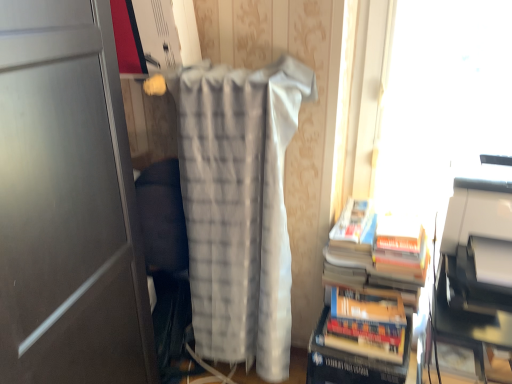
In order to face hardcover book at lower right, should I rotate leftwards or rightwards?

A 14.019 degree turn to the right will do.

What is the approximate height of white plastic printer at right?

white plastic printer at right is 9.37 inches tall.

In order to face hardcover books at right, should I rotate leftwards or rightwards?

To face it directly, rotate right by 15.361 degrees.

Identify the location of white textured blanket at center. click(x=239, y=206).

In order to click on transparent plastic window screen at upper right in this screenshot , I will do `click(443, 94)`.

Considering the sizes of objects white plastic printer at right and transparent plastic window screen at upper right in the image provided, who is bigger, white plastic printer at right or transparent plastic window screen at upper right?

With larger size is transparent plastic window screen at upper right.

Is white plastic printer at right next to transparent plastic window screen at upper right and touching it?

No.

From the image's perspective, relative to transparent plastic window screen at upper right, is white plastic printer at right above or below?

Based on their image positions, white plastic printer at right is located beneath transparent plastic window screen at upper right.

Which is behind, point (492, 267) or point (474, 45)?

The point (474, 45) is more distant.

From the image's perspective, does hardcover books at right appear higher than white textured blanket at center?

No.

Considering the positions of point (358, 326) and point (308, 85), is point (358, 326) closer or farther from the camera than point (308, 85)?

Clearly, point (358, 326) is closer to the camera than point (308, 85).

From a real-world perspective, which is physically below, hardcover books at right or white textured blanket at center?

In real-world perspective, hardcover books at right is lower.

From the image's perspective, which object appears higher, white plastic printer at right or hardcover books at right?

white plastic printer at right is shown above in the image.

Can you confirm if white plastic printer at right is taller than hardcover books at right?

No.

From a real-world perspective, which is physically above, white plastic printer at right or hardcover books at right?

white plastic printer at right, from a real-world perspective.

From the picture: What's the angular difference between white plastic printer at right and hardcover books at right's facing directions?

white plastic printer at right and hardcover books at right are facing 4.56 degrees away from each other.

From the image's perspective, is hardcover books at right over white plastic printer at right?

Actually, hardcover books at right appears below white plastic printer at right in the image.

Looking at this image, from a real-world perspective, is hardcover books at right physically located above or below white plastic printer at right?

From a real-world perspective, hardcover books at right is physically below white plastic printer at right.

Based on their positions, is hardcover books at right located to the left or right of white plastic printer at right?

In the image, hardcover books at right appears on the left side of white plastic printer at right.

Which is closer, (260, 310) or (452, 69)?

Point (260, 310).

Does white textured blanket at center appear on the left side of transparent plastic window screen at upper right?

Yes, white textured blanket at center is to the left of transparent plastic window screen at upper right.

How much distance is there between white textured blanket at center and transparent plastic window screen at upper right?

white textured blanket at center is 24.71 inches from transparent plastic window screen at upper right.

Where is `window screen above the white textured blanket at center (from a real-world perspective)`? The width and height of the screenshot is (512, 384). window screen above the white textured blanket at center (from a real-world perspective) is located at coordinates (443, 94).

Is hardcover books at right closer to camera compared to transparent plastic window screen at upper right?

Yes, it is.

Is transparent plastic window screen at upper right inside hardcover books at right?

That's incorrect, transparent plastic window screen at upper right is not inside hardcover books at right.

Which object is wider, hardcover books at right or transparent plastic window screen at upper right?

hardcover books at right is wider.

How many degrees apart are the facing directions of hardcover books at right and transparent plastic window screen at upper right?

hardcover books at right and transparent plastic window screen at upper right are facing 5.88 degrees away from each other.

Between hardcover book at lower right and white textured blanket at center, which one has smaller size?

hardcover book at lower right is smaller.

Is hardcover book at lower right spatially inside white textured blanket at center, or outside of it?

The correct answer is: outside.

Can you confirm if hardcover book at lower right is thinner than white textured blanket at center?

Yes, hardcover book at lower right is thinner than white textured blanket at center.

Which is closer to the camera, (x=336, y=333) or (x=227, y=188)?

Point (x=336, y=333) is farther from the camera than point (x=227, y=188).

You are a GUI agent. You are given a task and a screenshot of the screen. Output one action in this format:
    pyautogui.click(x=<x>, y=<y>)
    Task: Click on the printer that is above the transparent plastic window screen at upper right (from a real-world perspective)
    This screenshot has height=384, width=512.
    Given the screenshot: What is the action you would take?
    pyautogui.click(x=478, y=237)

Locate an element on the screen. The width and height of the screenshot is (512, 384). book to the right of white textured blanket at center is located at coordinates (361, 322).

When comparing their distances from white plastic printer at right, does transparent plastic window screen at upper right or hardcover books at right seem further?

The object further to white plastic printer at right is transparent plastic window screen at upper right.

When comparing their distances from hardcover books at right, does white plastic printer at right or transparent plastic window screen at upper right seem closer?

Based on the image, white plastic printer at right appears to be nearer to hardcover books at right.

When comparing their distances from white plastic printer at right, does hardcover books at right or white textured blanket at center seem further?

white textured blanket at center lies further to white plastic printer at right than the other object.

Estimate the real-world distances between objects in this image. Which object is closer to hardcover books at right, hardcover book at lower right or white textured blanket at center?

The object closer to hardcover books at right is hardcover book at lower right.

Estimate the real-world distances between objects in this image. Which object is closer to transparent plastic window screen at upper right, hardcover books at right or white plastic printer at right?

The object closer to transparent plastic window screen at upper right is white plastic printer at right.

From the picture: Considering their positions, is white textured blanket at center positioned further to hardcover books at right than hardcover book at lower right?

white textured blanket at center lies further to hardcover books at right than the other object.

Which object lies further to the anchor point white textured blanket at center, transparent plastic window screen at upper right or hardcover books at right?

transparent plastic window screen at upper right is further to white textured blanket at center.

From the image, which object appears to be nearer to transparent plastic window screen at upper right, white textured blanket at center or white plastic printer at right?

The object closer to transparent plastic window screen at upper right is white plastic printer at right.

Find the location of `paperback book between white textured blanket at center and transparent plastic window screen at upper right from left to right`. paperback book between white textured blanket at center and transparent plastic window screen at upper right from left to right is located at coordinates (367, 323).

This screenshot has height=384, width=512. Find the location of `paperback book between white textured blanket at center and white plastic printer at right from left to right`. paperback book between white textured blanket at center and white plastic printer at right from left to right is located at coordinates coord(367,323).

You are a GUI agent. You are given a task and a screenshot of the screen. Output one action in this format:
    pyautogui.click(x=<x>, y=<y>)
    Task: Click on the book between white plastic printer at right and transparent plastic window screen at upper right along the z-axis
    The image size is (512, 384).
    Given the screenshot: What is the action you would take?
    pyautogui.click(x=361, y=322)

Where is `book between transparent plastic window screen at upper right and hardcover book at lower right vertically`? The width and height of the screenshot is (512, 384). book between transparent plastic window screen at upper right and hardcover book at lower right vertically is located at coordinates (361, 322).